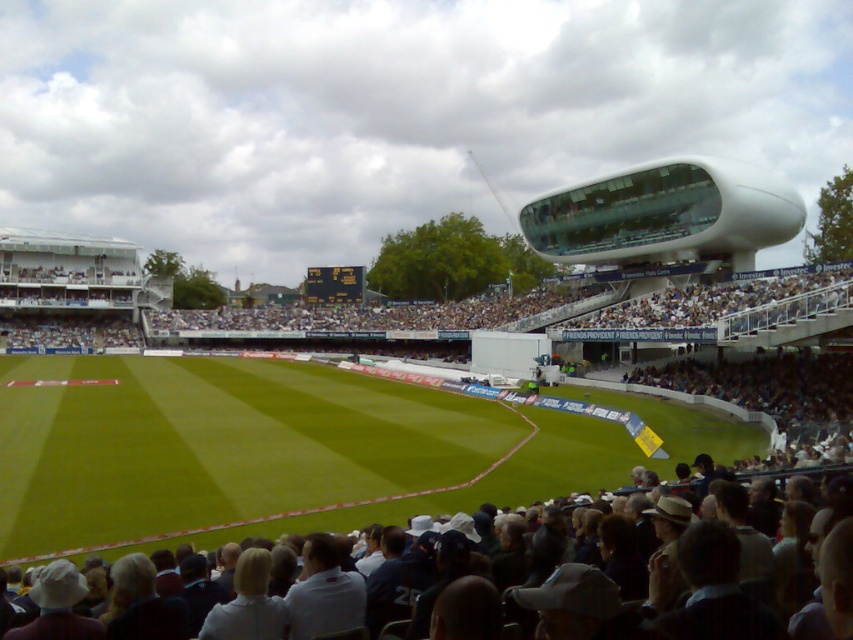
Which of these two, green grass at center or dark gray fabric crowd at lower center, stands taller?

With more height is dark gray fabric crowd at lower center.

Does green grass at center appear on the right side of dark gray fabric crowd at lower center?

Incorrect, green grass at center is not on the right side of dark gray fabric crowd at lower center.

What do you see at coordinates (288, 449) in the screenshot?
I see `green grass at center` at bounding box center [288, 449].

Image resolution: width=853 pixels, height=640 pixels. Identify the location of green grass at center. (288, 449).